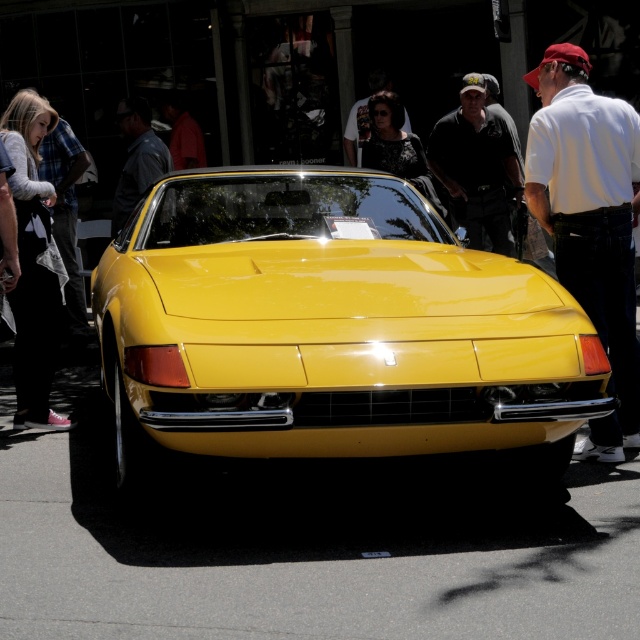
Does point (10, 106) come closer to viewer compared to point (481, 156)?

Yes, point (10, 106) is in front of point (481, 156).

Locate an element on the screen. The height and width of the screenshot is (640, 640). plaid flannel shirt at left is located at coordinates (33, 264).

Locate an element on the screen. This screenshot has height=640, width=640. plaid flannel shirt at left is located at coordinates (33, 264).

Between point (602, 97) and point (33, 266), which one is positioned behind?

Positioned behind is point (33, 266).

Between white cotton shirt at center and plaid flannel shirt at left, which one has more height?

Standing taller between the two is white cotton shirt at center.

Measure the distance between white cotton shirt at center and camera.

white cotton shirt at center and camera are 15.74 feet apart.

Locate an element on the screen. white cotton shirt at center is located at coordinates (589, 220).

Is white cotton shirt at center smaller than dark green shirt at center?

Actually, white cotton shirt at center might be larger than dark green shirt at center.

Who is more distant from viewer, (624, 132) or (481, 144)?

Point (481, 144)

Where is `white cotton shirt at center`? The width and height of the screenshot is (640, 640). white cotton shirt at center is located at coordinates (589, 220).